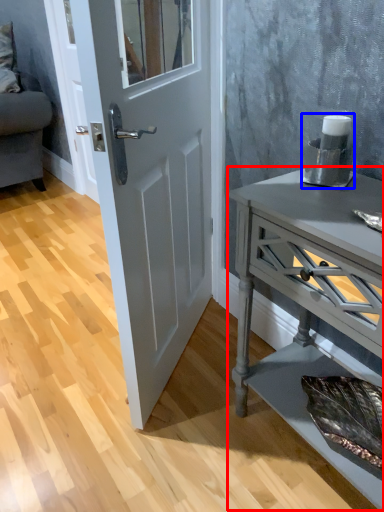
Question: Which object appears farthest to the camera in this image, nightstand (highlighted by a red box) or appliance (highlighted by a blue box)?

Choices:
 (A) nightstand
 (B) appliance

Answer: (B)